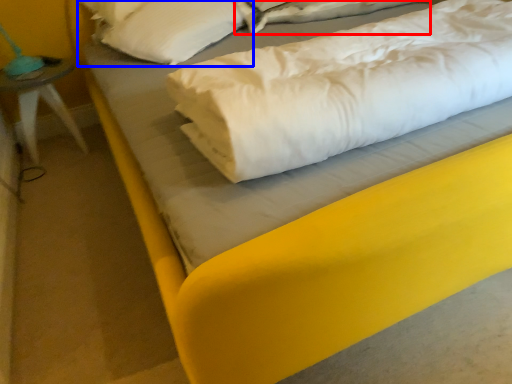
Question: Which object is closer to the camera taking this photo, sheet (highlighted by a red box) or pillow (highlighted by a blue box)?

Choices:
 (A) sheet
 (B) pillow

Answer: (B)